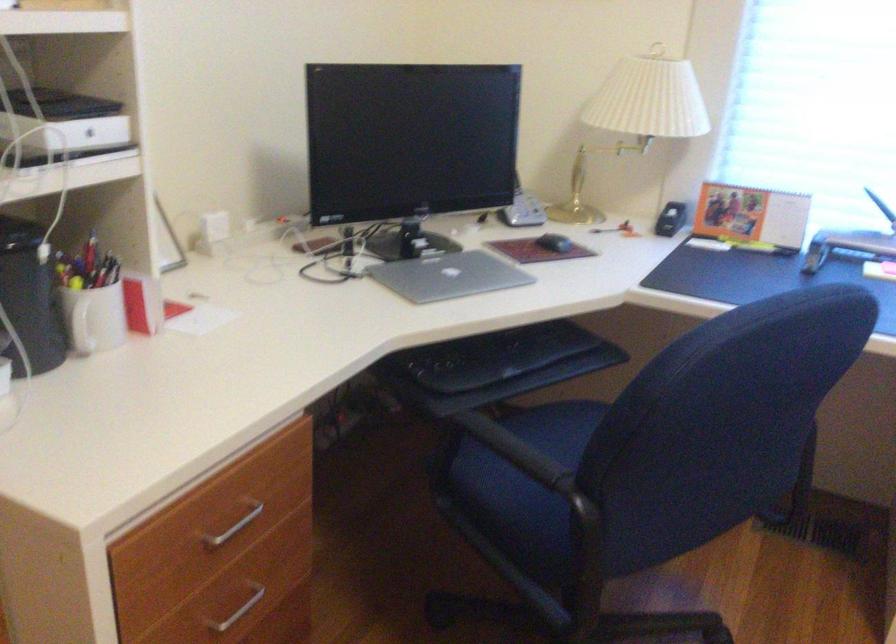
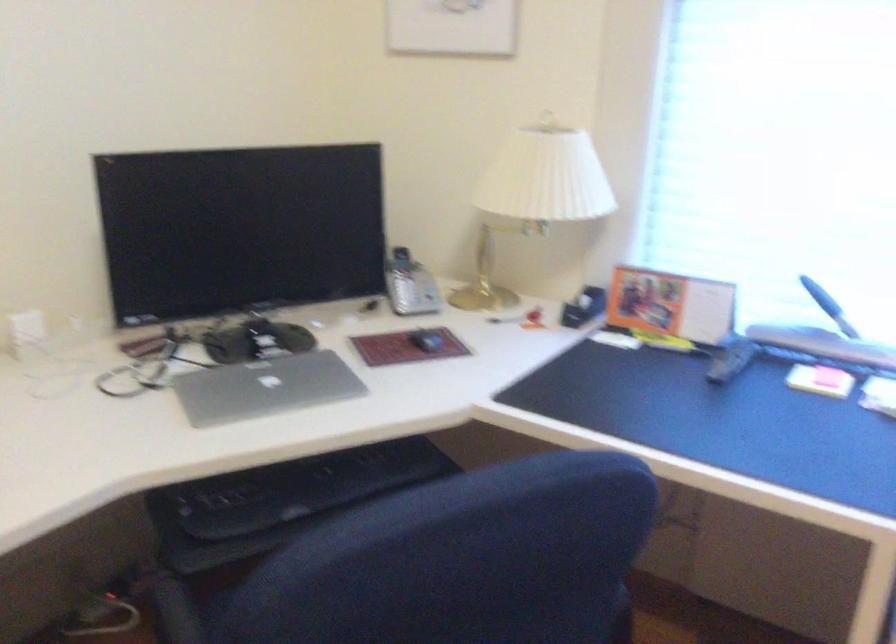
The point at (608, 230) is marked in the first image. Where is the corresponding point in the second image?

(504, 319)